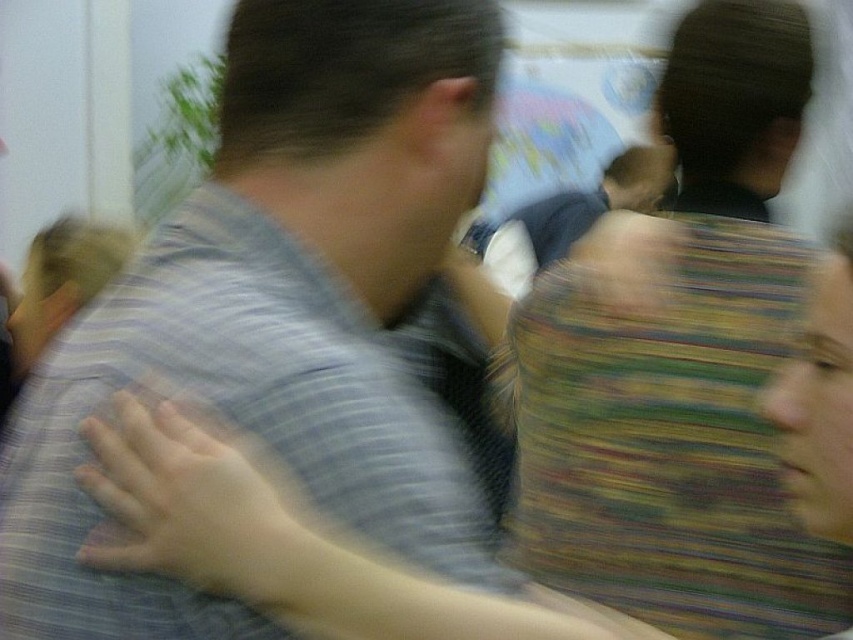
From the picture: Who is higher up, gray striped shirt at center or striped fabric bag at center?

striped fabric bag at center is above.

Does gray striped shirt at center have a greater width compared to striped fabric bag at center?

Correct, the width of gray striped shirt at center exceeds that of striped fabric bag at center.

The width and height of the screenshot is (853, 640). In order to click on gray striped shirt at center in this screenshot , I will do `click(280, 308)`.

Find the location of a particular element. This screenshot has width=853, height=640. gray striped shirt at center is located at coordinates (280, 308).

Can you confirm if gray striped shirt at center is positioned below matte gray shirt at upper left?

Incorrect, gray striped shirt at center is not positioned below matte gray shirt at upper left.

Is gray striped shirt at center wider than matte gray shirt at upper left?

Correct, the width of gray striped shirt at center exceeds that of matte gray shirt at upper left.

Where is `gray striped shirt at center`? The height and width of the screenshot is (640, 853). gray striped shirt at center is located at coordinates tap(280, 308).

This screenshot has width=853, height=640. I want to click on gray striped shirt at center, so click(x=280, y=308).

Does striped fabric bag at center come behind matte gray shirt at upper left?

Yes, it is.

Is striped fabric bag at center thinner than matte gray shirt at upper left?

Incorrect, striped fabric bag at center's width is not less than matte gray shirt at upper left's.

At what (x,y) coordinates should I click in order to perform the action: click on striped fabric bag at center. Please return your answer as a coordinate pair (x, y). This screenshot has height=640, width=853. Looking at the image, I should click on (679, 365).

Find the location of a particular element. The height and width of the screenshot is (640, 853). striped fabric bag at center is located at coordinates (679, 365).